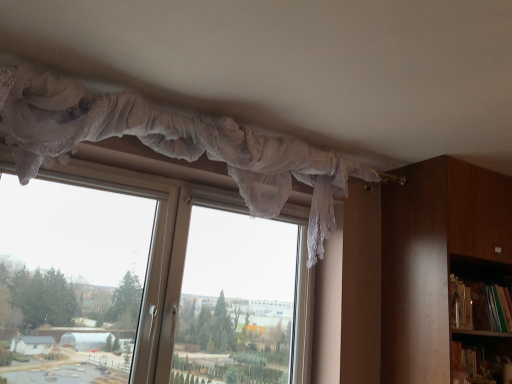
Question: Considering the relative sizes of green matte bookshelf at right and transparent lace curtain at upper center in the image provided, is green matte bookshelf at right taller than transparent lace curtain at upper center?

Choices:
 (A) yes
 (B) no

Answer: (B)

Question: Is green matte bookshelf at right to the left of transparent lace curtain at upper center from the viewer's perspective?

Choices:
 (A) yes
 (B) no

Answer: (B)

Question: Does green matte bookshelf at right have a smaller size compared to transparent lace curtain at upper center?

Choices:
 (A) no
 (B) yes

Answer: (B)

Question: From a real-world perspective, is green matte bookshelf at right over transparent lace curtain at upper center?

Choices:
 (A) yes
 (B) no

Answer: (A)

Question: Can you confirm if green matte bookshelf at right is thinner than transparent lace curtain at upper center?

Choices:
 (A) yes
 (B) no

Answer: (A)

Question: Is green matte bookshelf at right taller or shorter than white lace curtain at upper center?

Choices:
 (A) short
 (B) tall

Answer: (A)

Question: Is green matte bookshelf at right in front of or behind white lace curtain at upper center in the image?

Choices:
 (A) front
 (B) behind

Answer: (B)

Question: Is green matte bookshelf at right to the left or to the right of white lace curtain at upper center in the image?

Choices:
 (A) left
 (B) right

Answer: (B)

Question: Does point (454, 316) appear closer or farther from the camera than point (40, 134)?

Choices:
 (A) farther
 (B) closer

Answer: (A)

Question: In the image, is brown wooden bookcase at right positioned in front of or behind transparent lace curtain at upper center?

Choices:
 (A) behind
 (B) front

Answer: (A)

Question: Looking at the image, does brown wooden bookcase at right seem bigger or smaller compared to transparent lace curtain at upper center?

Choices:
 (A) small
 (B) big

Answer: (A)

Question: Is brown wooden bookcase at right to the left or to the right of transparent lace curtain at upper center in the image?

Choices:
 (A) right
 (B) left

Answer: (A)

Question: Is point (478, 370) positioned closer to the camera than point (10, 160)?

Choices:
 (A) closer
 (B) farther

Answer: (B)

Question: Is green matte bookshelf at right situated inside transparent lace curtain at upper center or outside?

Choices:
 (A) outside
 (B) inside

Answer: (A)

Question: Does point (492, 309) appear closer or farther from the camera than point (296, 382)?

Choices:
 (A) closer
 (B) farther

Answer: (A)